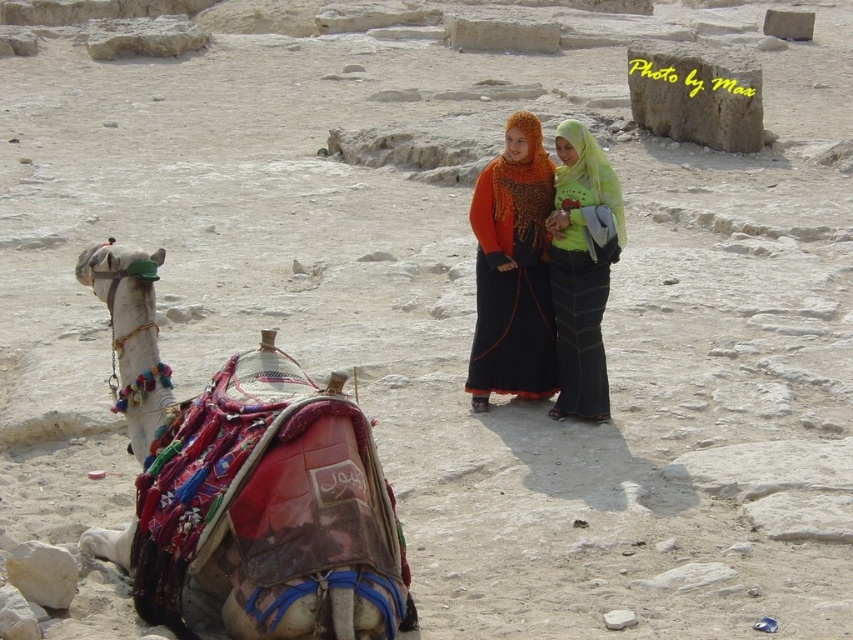
Does decorative fabric camel at left appear on the left side of green fabric hijab at center?

Correct, you'll find decorative fabric camel at left to the left of green fabric hijab at center.

What do you see at coordinates (247, 484) in the screenshot? I see `decorative fabric camel at left` at bounding box center [247, 484].

I want to click on decorative fabric camel at left, so [247, 484].

Is decorative fabric camel at left further to the viewer compared to orange knitted scarf at center?

No, decorative fabric camel at left is closer to the viewer.

Does decorative fabric camel at left appear on the left side of orange knitted scarf at center?

Yes, decorative fabric camel at left is to the left of orange knitted scarf at center.

At what (x,y) coordinates should I click in order to perform the action: click on decorative fabric camel at left. Please return your answer as a coordinate pair (x, y). The height and width of the screenshot is (640, 853). Looking at the image, I should click on (247, 484).

Which of these two, orange knitted scarf at center or green fabric hijab at center, stands shorter?

Standing shorter between the two is orange knitted scarf at center.

Is point (535, 225) positioned behind point (575, 186)?

Yes, it is behind point (575, 186).

Locate an element on the screen. orange knitted scarf at center is located at coordinates (512, 269).